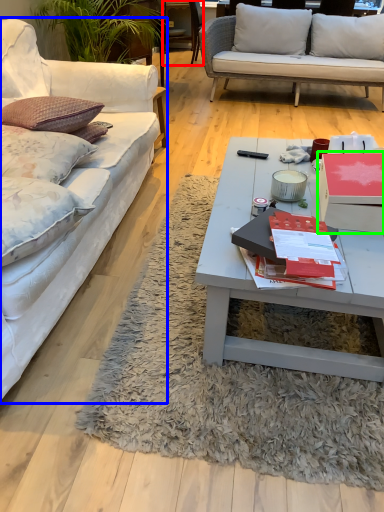
Question: Which object is the closest to the chair (highlighted by a red box)? Choose among these: studio couch (highlighted by a blue box) or box (highlighted by a green box).

Choices:
 (A) studio couch
 (B) box

Answer: (A)